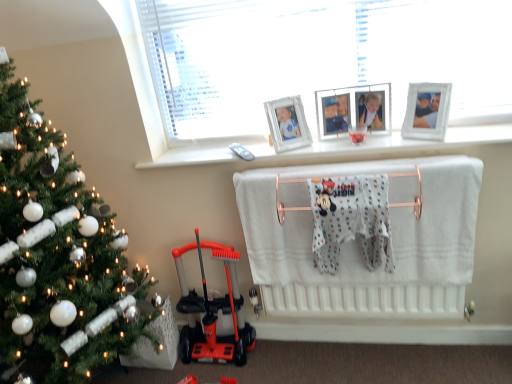
Locate an element on the screen. The height and width of the screenshot is (384, 512). free spot above white fabric infant bed at center (from a real-world perspective) is located at coordinates (354, 166).